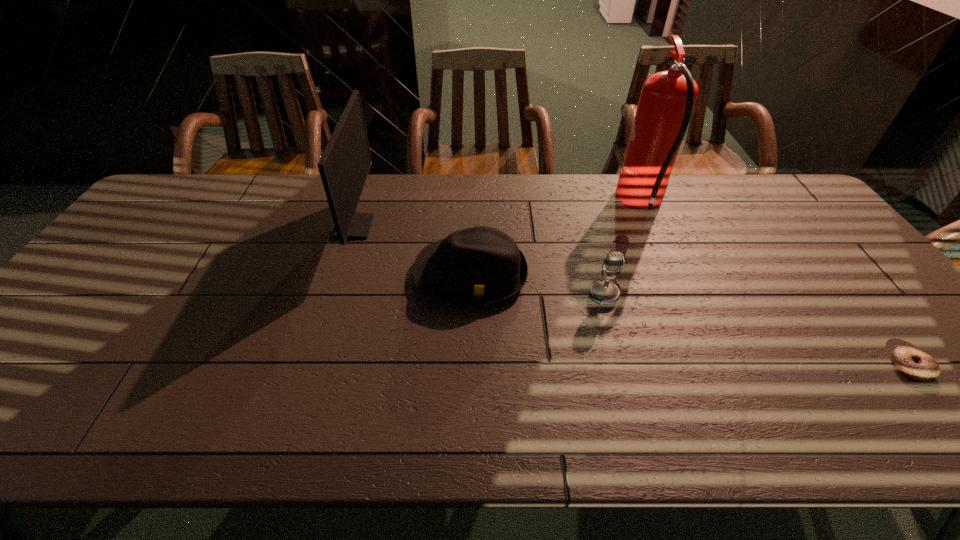
Locate an element on the screen. This screenshot has width=960, height=540. vacant space that is in between the microphone and the doughnut is located at coordinates (756, 332).

This screenshot has height=540, width=960. I want to click on vacant space that's between the fourth object from right to left and the second tallest object, so click(x=413, y=251).

Locate an element on the screen. This screenshot has width=960, height=540. free space between the tallest object and the shortest object is located at coordinates (776, 285).

I want to click on vacant point located between the third object from left to right and the nearest object, so click(756, 332).

You are a GUI agent. You are given a task and a screenshot of the screen. Output one action in this format:
    pyautogui.click(x=<x>, y=<y>)
    Task: Click on the free area in between the third object from left to right and the second object from left to right
    
    Given the screenshot: What is the action you would take?
    pyautogui.click(x=537, y=285)

The width and height of the screenshot is (960, 540). Find the location of `the third closest object to the leftmost object`. the third closest object to the leftmost object is located at coordinates pyautogui.click(x=667, y=99).

Identify the location of object that is the closest one to the fire extinguisher. The image size is (960, 540). (605, 292).

Identify the location of vacant region that satisfies the following two spatial constraints: 1. towards the nozzle of the tallest object; 2. on the front-facing side of the second shortest object. (674, 275).

Where is `blank area in the image that satisfies the following two spatial constraints: 1. on the front-facing side of the second object from left to right; 2. on the left side of the rightmost object`? blank area in the image that satisfies the following two spatial constraints: 1. on the front-facing side of the second object from left to right; 2. on the left side of the rightmost object is located at coordinates (468, 367).

This screenshot has width=960, height=540. Identify the location of vacant area in the image that satisfies the following two spatial constraints: 1. towards the nozzle of the rightmost object; 2. on the left side of the fire extinguisher. (714, 367).